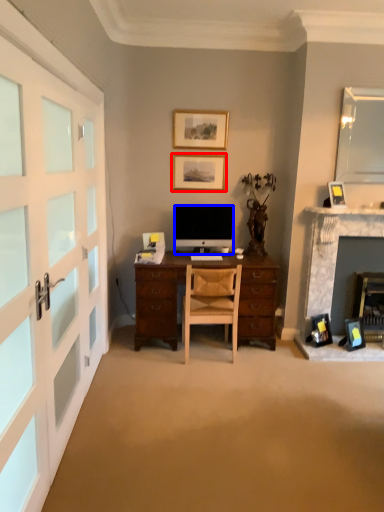
Question: Among these objects, which one is farthest to the camera, picture frame (highlighted by a red box) or computer monitor (highlighted by a blue box)?

Choices:
 (A) picture frame
 (B) computer monitor

Answer: (A)